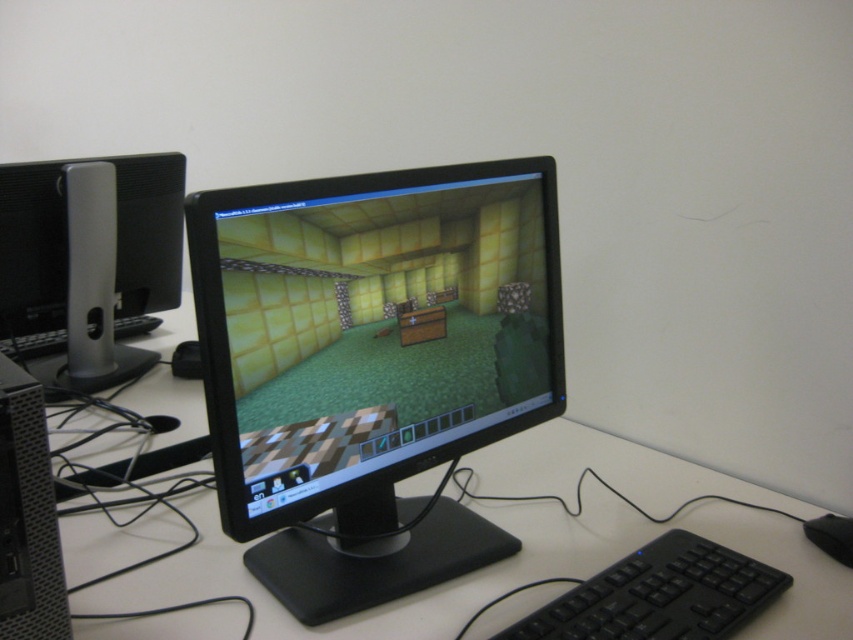
Question: Among these points, which one is nearest to the camera?

Choices:
 (A) (769, 516)
 (B) (224, 458)
 (C) (97, 259)
 (D) (721, 570)

Answer: (B)

Question: Which point is farther to the camera?

Choices:
 (A) black glossy monitor at center
 (B) silver/black plastic monitor at left
 (C) white plastic computer desk at center

Answer: (B)

Question: Which object appears closest to the camera in this image?

Choices:
 (A) silver/black plastic monitor at left
 (B) black plastic keyboard at lower right
 (C) white plastic computer desk at center

Answer: (B)

Question: In this image, where is black glossy monitor at center located relative to white plastic computer desk at center?

Choices:
 (A) above
 (B) below

Answer: (A)

Question: Is silver/black plastic monitor at left wider than black textured computer tower at lower left?

Choices:
 (A) yes
 (B) no

Answer: (A)

Question: From the image, what is the correct spatial relationship of black glossy monitor at center in relation to black plastic mouse at lower right?

Choices:
 (A) left
 (B) right

Answer: (A)